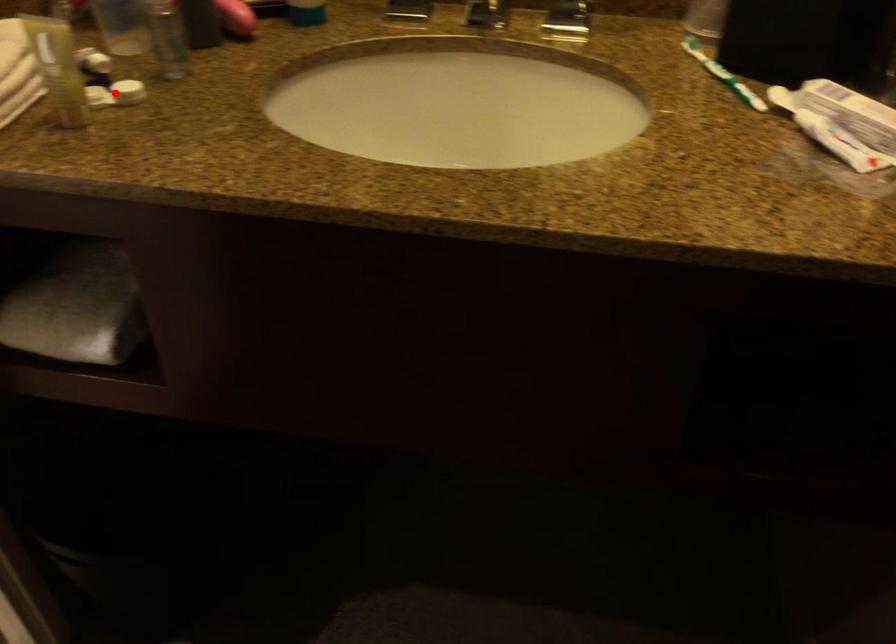
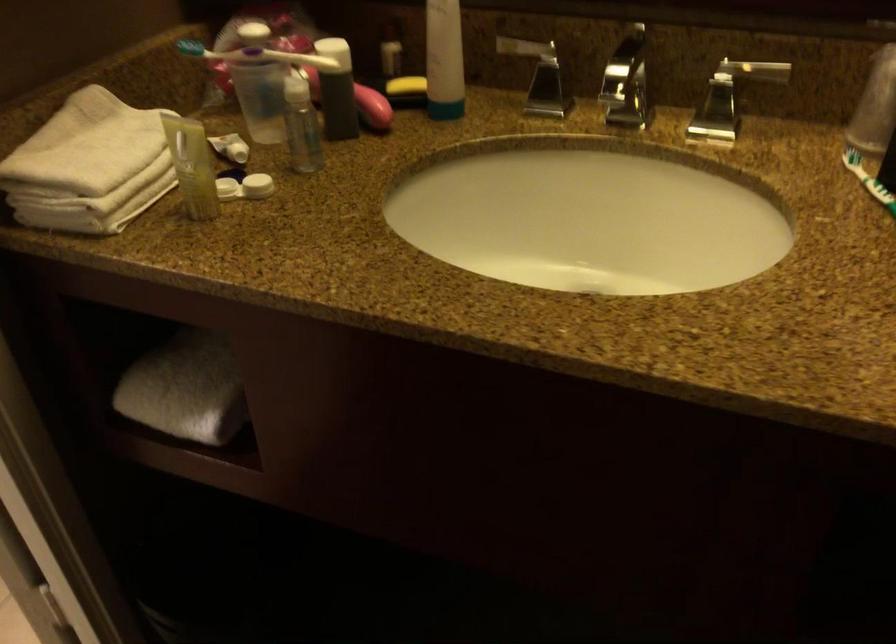
Locate, in the second image, the point that corresponds to the highlighted location in the first image.

(245, 187)